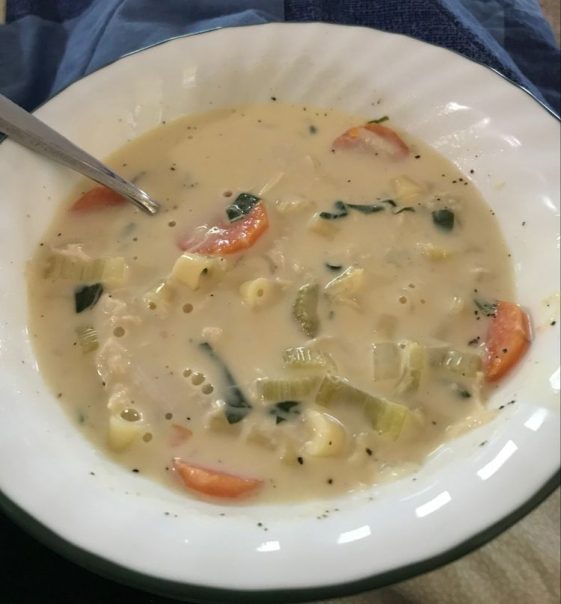
I want to click on blanket or fabric, so click(439, 23).